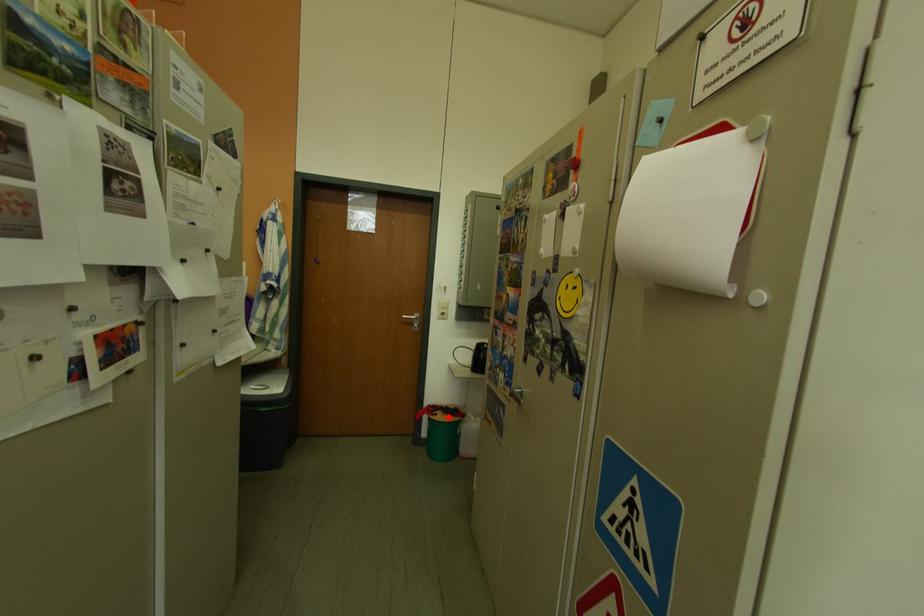
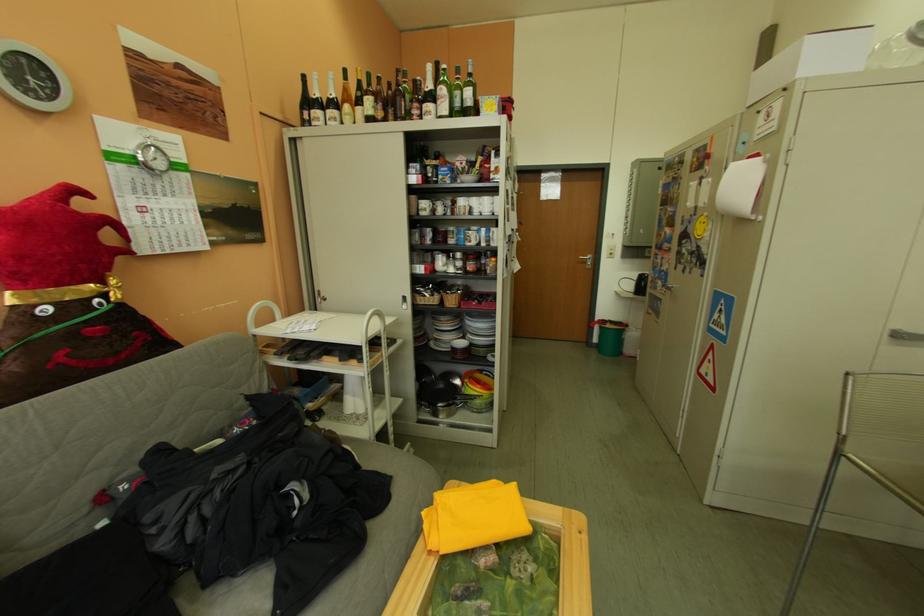
Question: I am providing you with two images of the same scene from different viewpoints. In image1, a red point is highlighted. Considering the same 3D point in image2, which of the following is correct?

Choices:
 (A) It is closer
 (B) It is farther

Answer: (A)